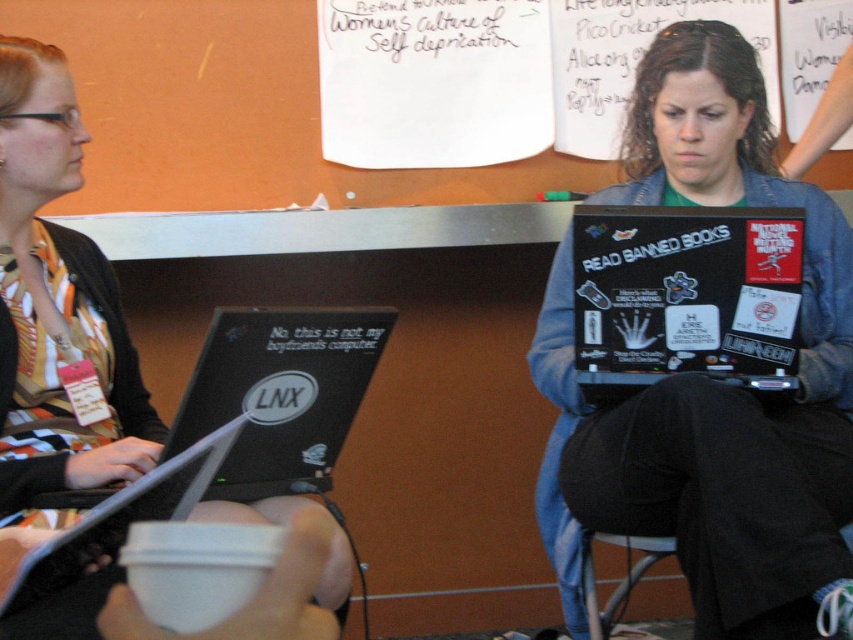
What are the coordinates of the black glossy laptop at center?

The coordinates of the black glossy laptop at center are point (706, 378).

In the scene shown: You are a photographer trying to capture a clear shot of both the white paper at upper center and the black matte laptop at lower left. Which object should you focus on first to ensure both are in focus?

You should focus on the white paper at upper center first because it is closer to the viewer than the black matte laptop at lower left. By focusing on the closer object, the depth of field may allow the farther object to also be in focus.